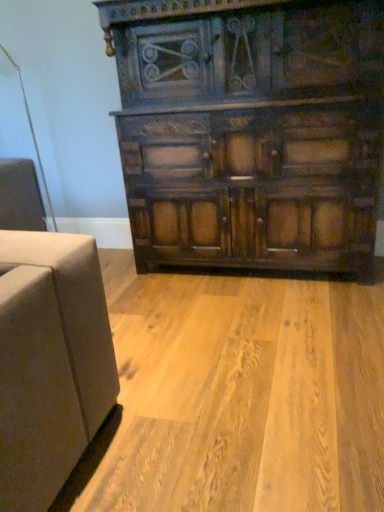
Question: Is dark wood cabinet at center in front of or behind natural wood floor at center in the image?

Choices:
 (A) front
 (B) behind

Answer: (B)

Question: Is point (362, 220) positioned closer to the camera than point (119, 486)?

Choices:
 (A) farther
 (B) closer

Answer: (A)

Question: From their relative heights in the image, would you say dark wood cabinet at center is taller or shorter than natural wood floor at center?

Choices:
 (A) short
 (B) tall

Answer: (B)

Question: Considering the positions of natural wood floor at center and dark wood cabinet at center in the image, is natural wood floor at center wider or thinner than dark wood cabinet at center?

Choices:
 (A) wide
 (B) thin

Answer: (A)

Question: From the image's perspective, is natural wood floor at center above or below dark wood cabinet at center?

Choices:
 (A) below
 (B) above

Answer: (A)

Question: Considering the positions of point (319, 424) and point (314, 143), is point (319, 424) closer or farther from the camera than point (314, 143)?

Choices:
 (A) farther
 (B) closer

Answer: (B)

Question: Is natural wood floor at center taller or shorter than dark wood cabinet at center?

Choices:
 (A) short
 (B) tall

Answer: (A)